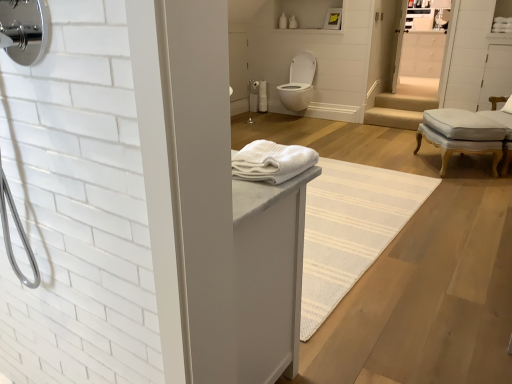
You are a GUI agent. You are given a task and a screenshot of the screen. Output one action in this format:
    pyautogui.click(x=<x>, y=<y>)
    Task: Click on the vacant area situated to the left side of light gray fabric ottoman at right
    Image resolution: width=512 pixels, height=384 pixels.
    Given the screenshot: What is the action you would take?
    pyautogui.click(x=395, y=163)